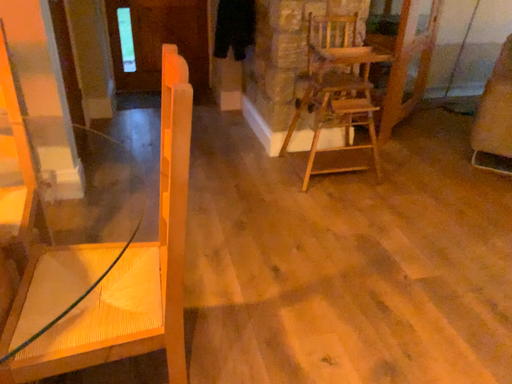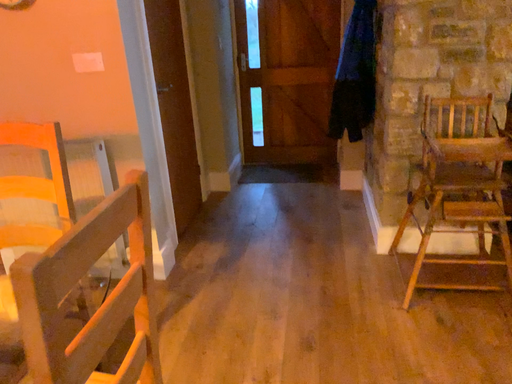
Question: Which way did the camera rotate in the video?

Choices:
 (A) rotated upward
 (B) rotated downward

Answer: (A)